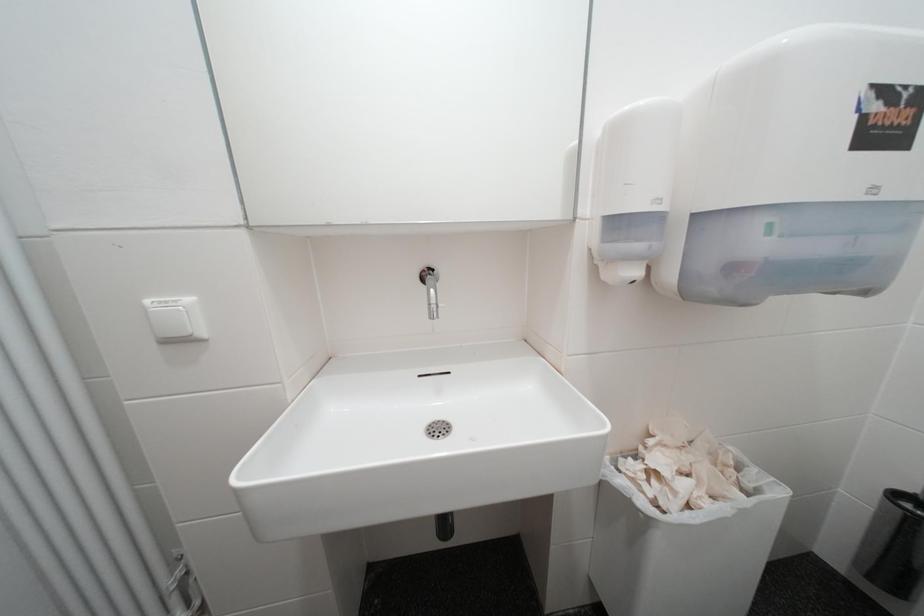
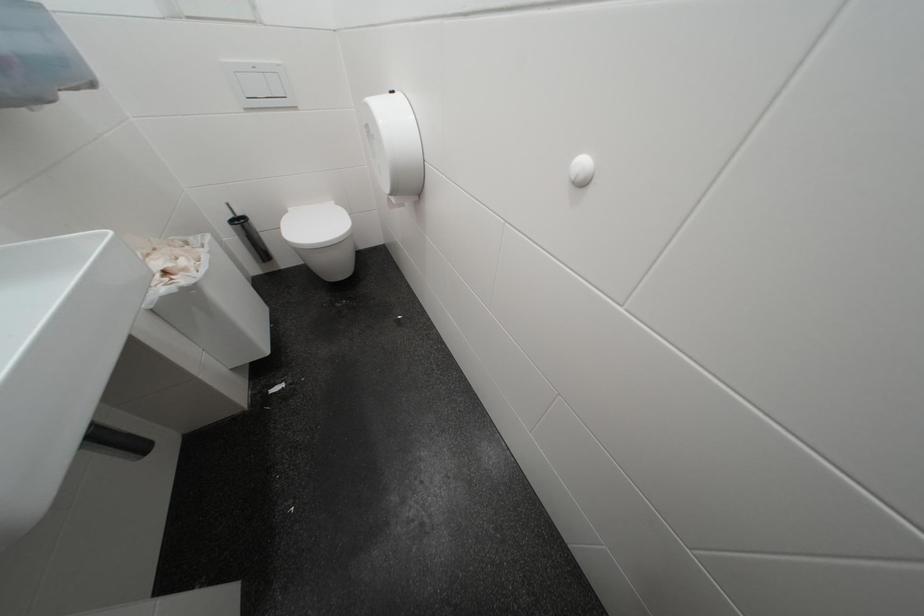
Based on the continuous images, in which direction is the camera rotating?

The camera rotated toward right-down.